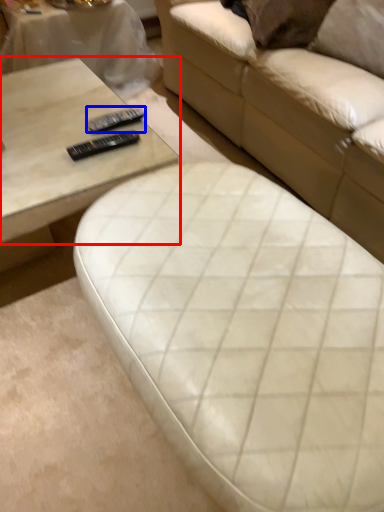
Question: Which of the following is the farthest to the observer, coffee table (highlighted by a red box) or remote (highlighted by a blue box)?

Choices:
 (A) coffee table
 (B) remote

Answer: (B)